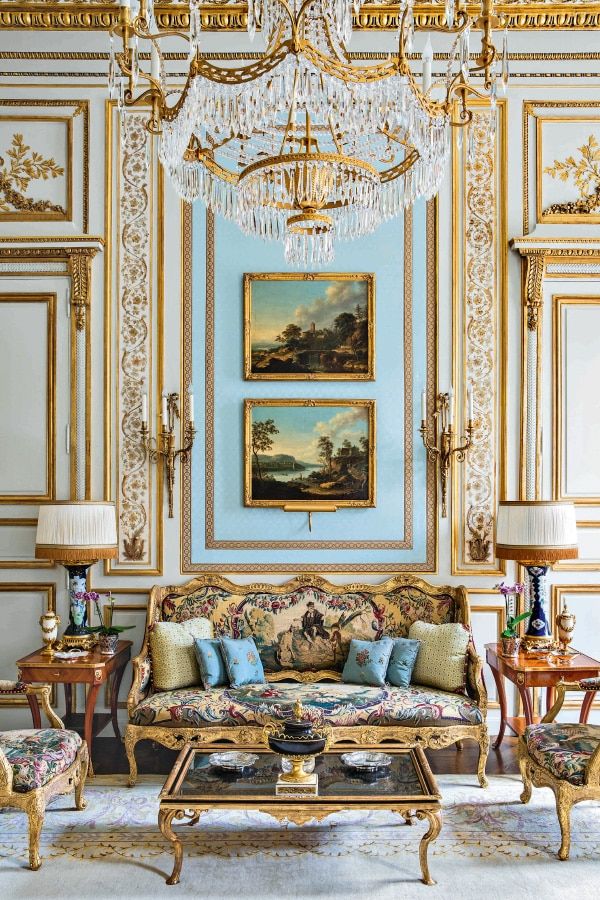
I want to click on chairs, so click(x=566, y=753), click(x=62, y=754).